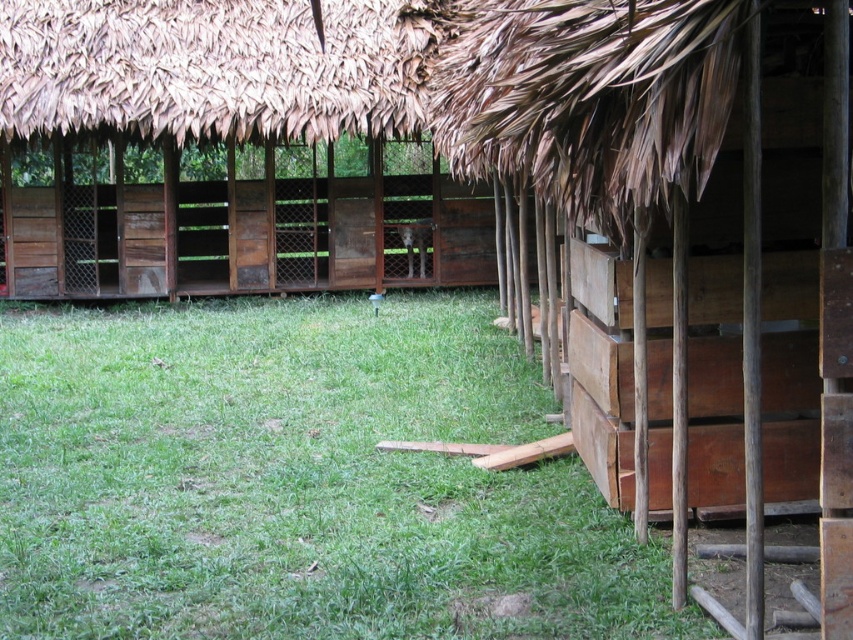
You are a farmer who wants to stack hay bales on top of the wooden crates at center. The brown thatch roof at upper center is directly above the crates. Will the hay bales fit under the roof without touching it?

The wooden crates at center is taller than brown thatch roof at upper center, so the hay bales will not fit under the roof without touching it because the crates already extend higher than the roof.

You are a farmer who needs to move a heavy item from the wooden crates at center to the brown thatch roof at upper center. Which direction should you move the item to reach the roof?

The wooden crates at center are to the right of the brown thath roof at upper center, so you should move the item to the left to reach the roof.